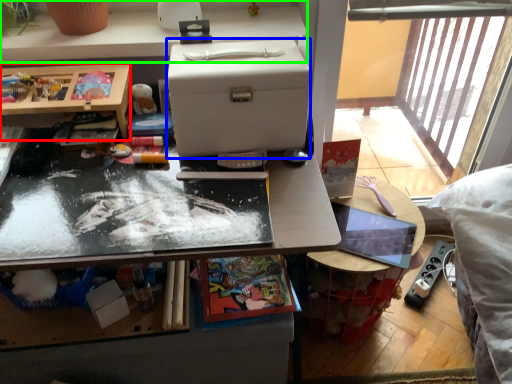
Question: Estimate the real-world distances between objects in this image. Which object is farther from desk (highlighted by a red box), box (highlighted by a blue box) or desk (highlighted by a green box)?

Choices:
 (A) box
 (B) desk

Answer: (A)